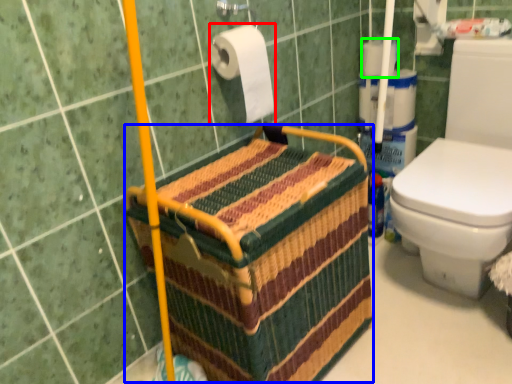
Question: Which object is positioned closest to toilet paper (highlighted by a red box)? Select from basket (highlighted by a blue box) and toilet paper (highlighted by a green box).

Choices:
 (A) basket
 (B) toilet paper

Answer: (A)